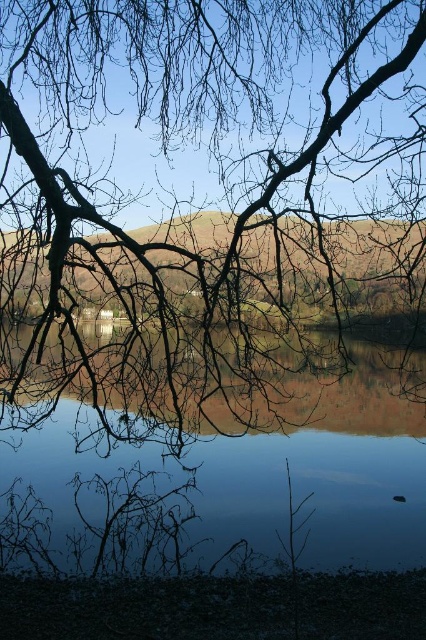
Is brown/rough branches at upper center smaller than transparent glass water at center?

No.

Is brown/rough branches at upper center to the left of transparent glass water at center from the viewer's perspective?

A: Yes, brown/rough branches at upper center is to the left of transparent glass water at center.

I want to click on brown/rough branches at upper center, so click(201, 211).

Where is `brown/rough branches at upper center`? brown/rough branches at upper center is located at coordinates (201, 211).